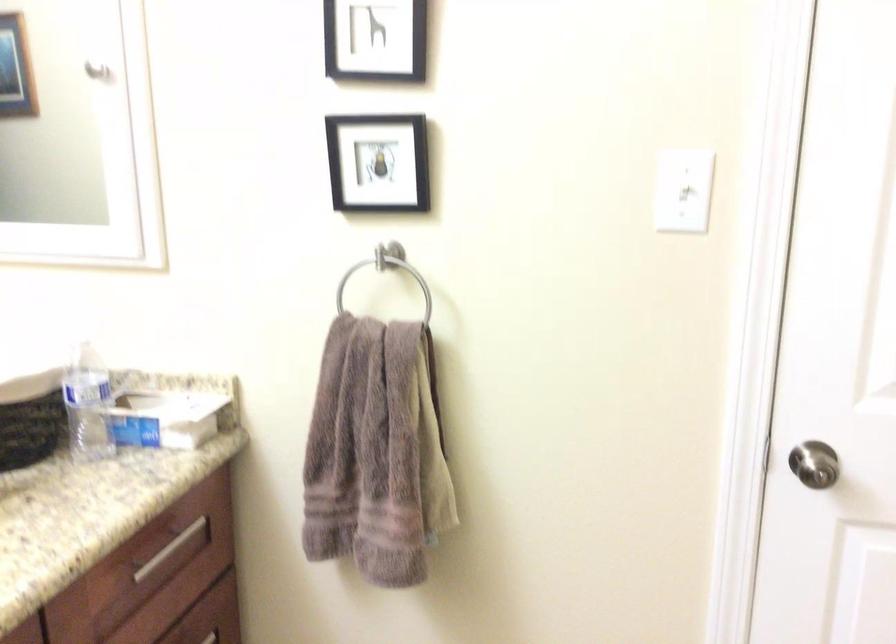
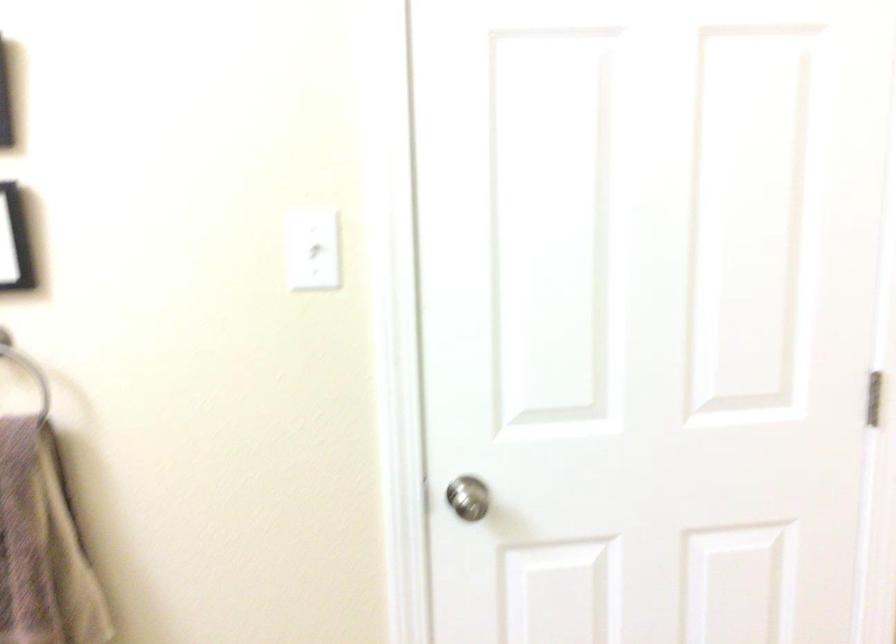
Question: In a continuous first-person perspective shot, in which direction is the camera moving?

Choices:
 (A) Left
 (B) Right
 (C) Forward
 (D) Backward

Answer: (B)